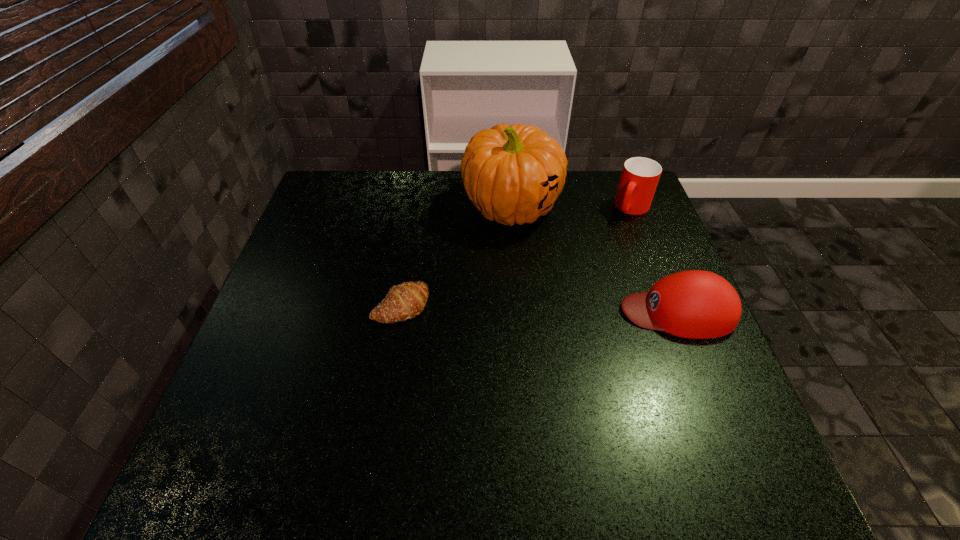
Identify the location of the shortest object. (407, 300).

This screenshot has width=960, height=540. I want to click on the leftmost object, so click(407, 300).

What are the coordinates of `baseball cap` in the screenshot? It's located at (695, 304).

Where is `pumpkin`? Image resolution: width=960 pixels, height=540 pixels. pumpkin is located at coordinates (514, 174).

The image size is (960, 540). What are the coordinates of `the tallest object` in the screenshot? It's located at (514, 174).

Image resolution: width=960 pixels, height=540 pixels. In order to click on cup in this screenshot , I will do `click(640, 176)`.

Identify the location of vacant space located on the back of the shortest object. (413, 234).

The width and height of the screenshot is (960, 540). I want to click on vacant space located 0.190m on the front-facing side of the baseball cap, so coord(541,311).

Locate an element on the screen. The width and height of the screenshot is (960, 540). free location located 0.390m on the front-facing side of the baseball cap is located at coordinates (458, 311).

You are a GUI agent. You are given a task and a screenshot of the screen. Output one action in this format:
    pyautogui.click(x=<x>, y=<y>)
    Task: Click on the vacant region located 0.100m on the front-facing side of the baseball cap
    The image size is (960, 540).
    Given the screenshot: What is the action you would take?
    579,311